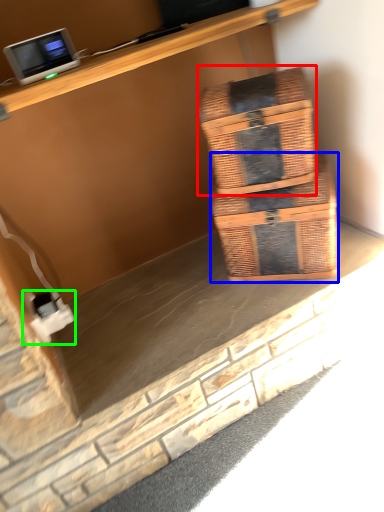
Question: Estimate the real-world distances between objects in this image. Which object is closer to box (highlighted by a red box), box (highlighted by a blue box) or electric outlet (highlighted by a green box)?

Choices:
 (A) box
 (B) electric outlet

Answer: (A)